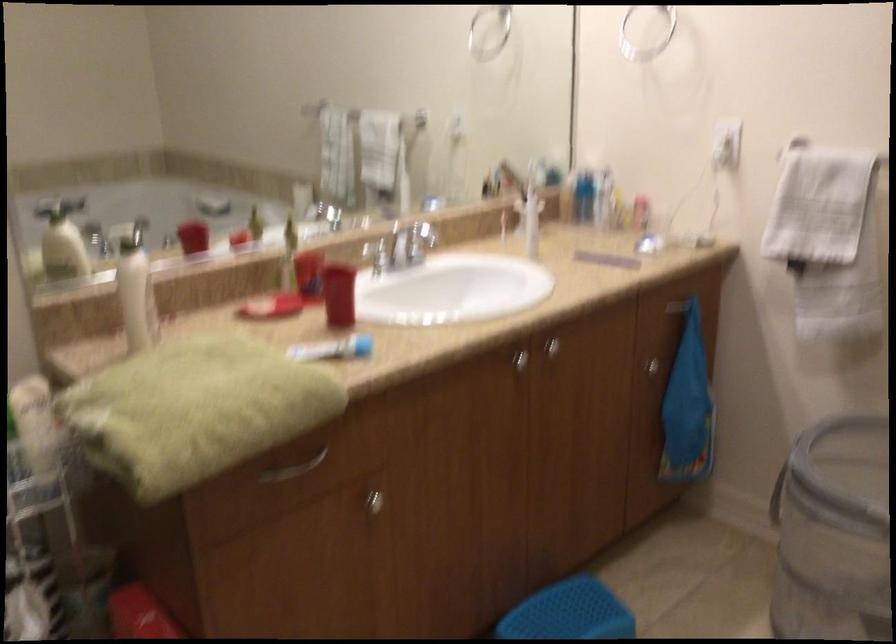
At what (x,y) coordinates should I click in order to perform the action: click on silver faucet handle. Please return your answer as a coordinate pair (x, y). Image resolution: width=896 pixels, height=644 pixels. Looking at the image, I should click on (418, 242).